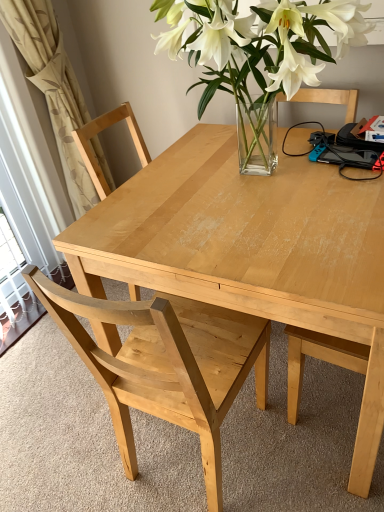
Identify the location of free spot to the left of light wood chair at center. This screenshot has height=512, width=384. (72, 446).